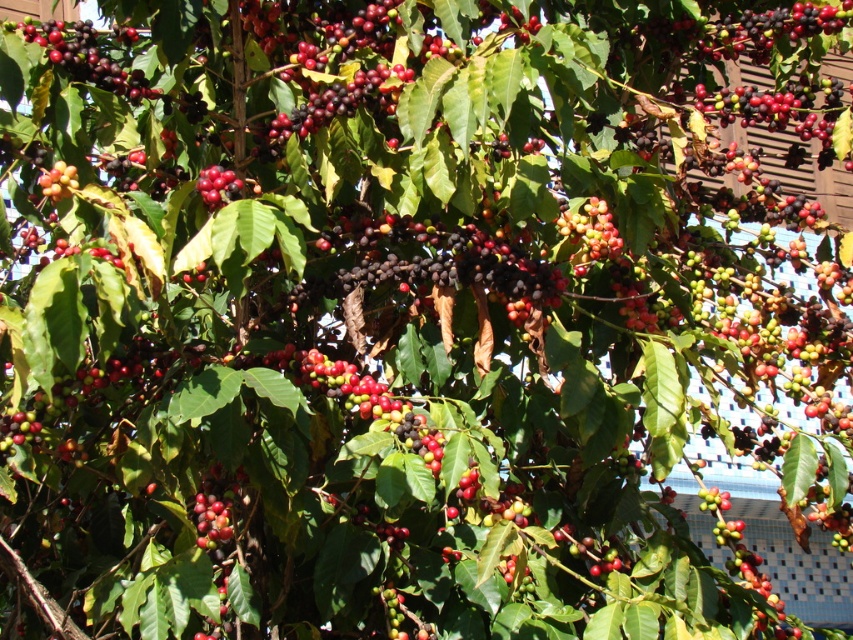
Question: Is shiny red berries at center smaller than glossy red berry at upper left?

Choices:
 (A) yes
 (B) no

Answer: (B)

Question: Which object is closer to the camera taking this photo?

Choices:
 (A) shiny red berries at center
 (B) glossy red berry at upper left
 (C) shiny dark red berries at upper left

Answer: (B)

Question: Which of the following is the farthest from the observer?

Choices:
 (A) (62, 58)
 (B) (233, 172)
 (C) (55, 179)

Answer: (A)

Question: Is shiny dark red berries at upper left below glossy red berry at upper left?

Choices:
 (A) yes
 (B) no

Answer: (B)

Question: Does shiny dark red berries at upper left have a greater width compared to glossy red berry at upper left?

Choices:
 (A) no
 (B) yes

Answer: (B)

Question: Which object is positioned farthest from the glossy red berry at upper left?

Choices:
 (A) shiny dark red berries at upper left
 (B) shiny red berries at center

Answer: (A)